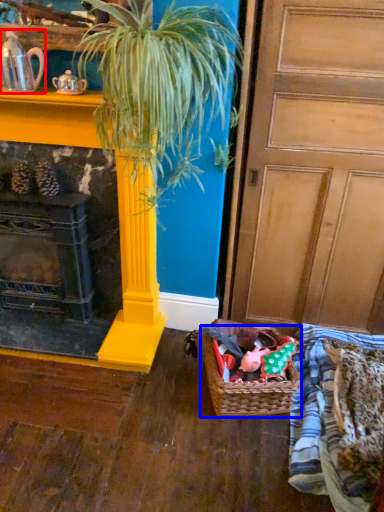
Question: Which point is closer to the camera, tea pot (highlighted by a red box) or basket (highlighted by a blue box)?

Choices:
 (A) tea pot
 (B) basket

Answer: (A)